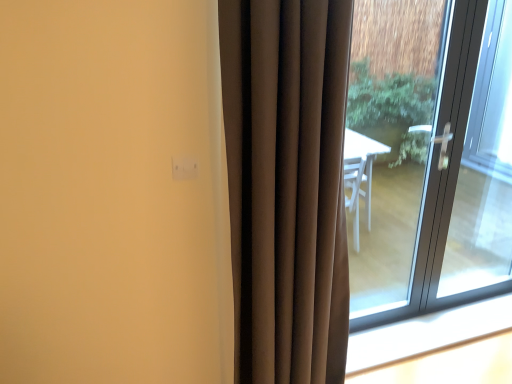
Question: From the image's perspective, is transparent glass door at right located above white plastic window sill at lower right?

Choices:
 (A) no
 (B) yes

Answer: (B)

Question: Does transparent glass door at right contain white plastic window sill at lower right?

Choices:
 (A) yes
 (B) no

Answer: (B)

Question: Is transparent glass door at right bigger than white plastic window sill at lower right?

Choices:
 (A) no
 (B) yes

Answer: (B)

Question: Considering the relative sizes of transparent glass door at right and white plastic window sill at lower right in the image provided, is transparent glass door at right taller than white plastic window sill at lower right?

Choices:
 (A) yes
 (B) no

Answer: (A)

Question: Considering the relative positions of transparent glass door at right and white plastic window sill at lower right in the image provided, is transparent glass door at right to the right of white plastic window sill at lower right from the viewer's perspective?

Choices:
 (A) no
 (B) yes

Answer: (A)

Question: Is the position of transparent glass door at right less distant than that of white plastic window sill at lower right?

Choices:
 (A) no
 (B) yes

Answer: (B)

Question: Is white plastic window sill at lower right thinner than transparent glass door at right?

Choices:
 (A) no
 (B) yes

Answer: (B)

Question: Is white plastic window sill at lower right in contact with transparent glass door at right?

Choices:
 (A) yes
 (B) no

Answer: (B)

Question: Does white plastic window sill at lower right lie behind transparent glass door at right?

Choices:
 (A) yes
 (B) no

Answer: (A)

Question: Does white plastic window sill at lower right appear on the right side of transparent glass door at right?

Choices:
 (A) yes
 (B) no

Answer: (A)

Question: Can you confirm if white plastic window sill at lower right is shorter than transparent glass door at right?

Choices:
 (A) no
 (B) yes

Answer: (B)

Question: Is white plastic window sill at lower right not within transparent glass door at right?

Choices:
 (A) no
 (B) yes

Answer: (B)

Question: Can you confirm if clear glass door at right is bigger than white plastic window sill at lower right?

Choices:
 (A) no
 (B) yes

Answer: (B)